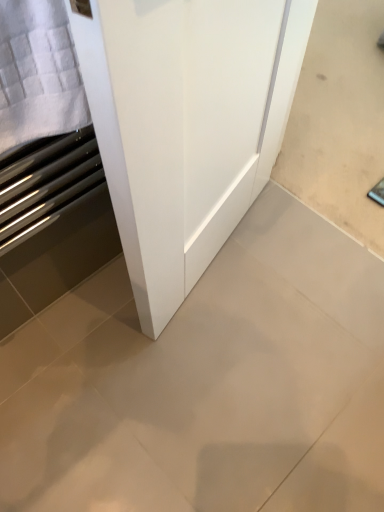
Question: Looking at the image, does white textured towel at left seem bigger or smaller compared to matte gray tile at center?

Choices:
 (A) small
 (B) big

Answer: (A)

Question: Is point (64, 55) closer or farther from the camera than point (372, 278)?

Choices:
 (A) farther
 (B) closer

Answer: (B)

Question: Is white textured towel at left spatially inside matte gray tile at center, or outside of it?

Choices:
 (A) inside
 (B) outside

Answer: (B)

Question: Relative to white textured towel at left, is matte gray tile at center in front or behind?

Choices:
 (A) behind
 (B) front

Answer: (A)

Question: Considering the positions of matte gray tile at center and white textured towel at left in the image, is matte gray tile at center wider or thinner than white textured towel at left?

Choices:
 (A) thin
 (B) wide

Answer: (B)

Question: Based on their sizes in the image, would you say matte gray tile at center is bigger or smaller than white textured towel at left?

Choices:
 (A) small
 (B) big

Answer: (B)

Question: Is point (112, 373) closer or farther from the camera than point (46, 28)?

Choices:
 (A) closer
 (B) farther

Answer: (B)